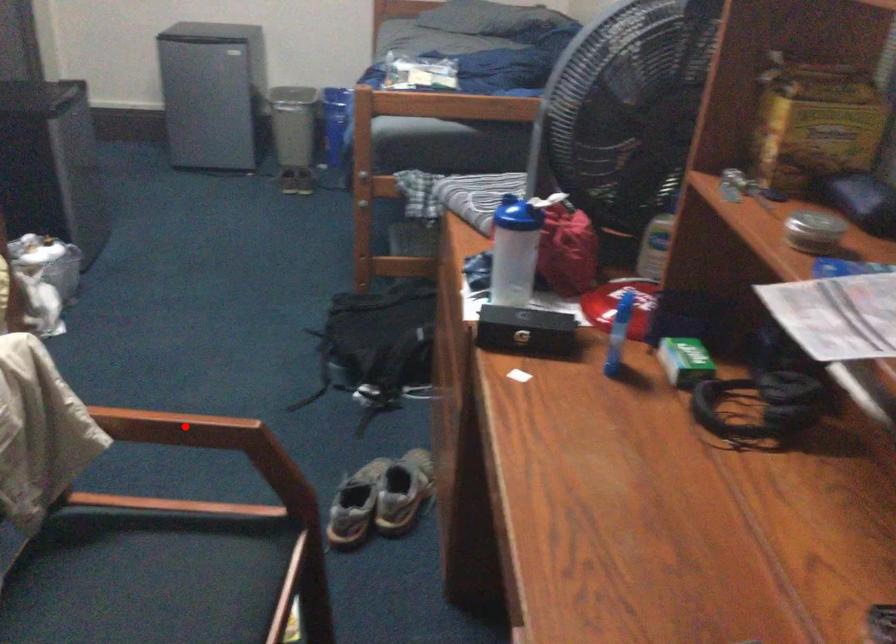
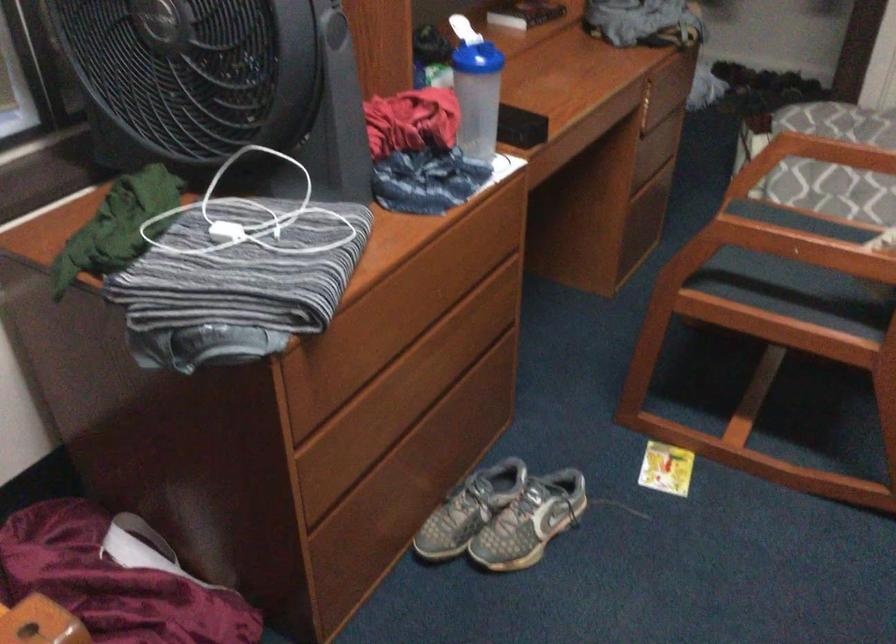
Question: I am providing you with two images of the same scene from different viewpoints. Image1 has a red point marked. In image2, the corresponding 3D location appears at what relative position? Reply with the corresponding letter.

Choices:
 (A) Closer
 (B) Farther

Answer: (B)